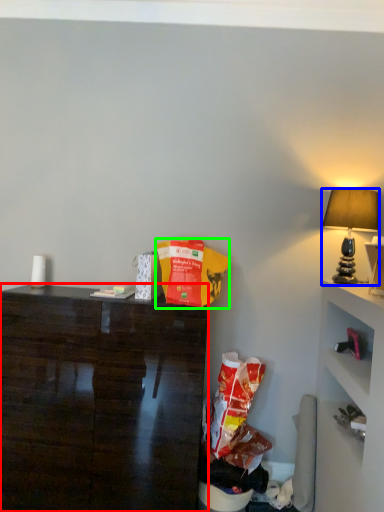
Question: Which object is the closest to the desk (highlighted by a red box)? Choose among these: lamp (highlighted by a blue box) or paper bag (highlighted by a green box).

Choices:
 (A) lamp
 (B) paper bag

Answer: (B)